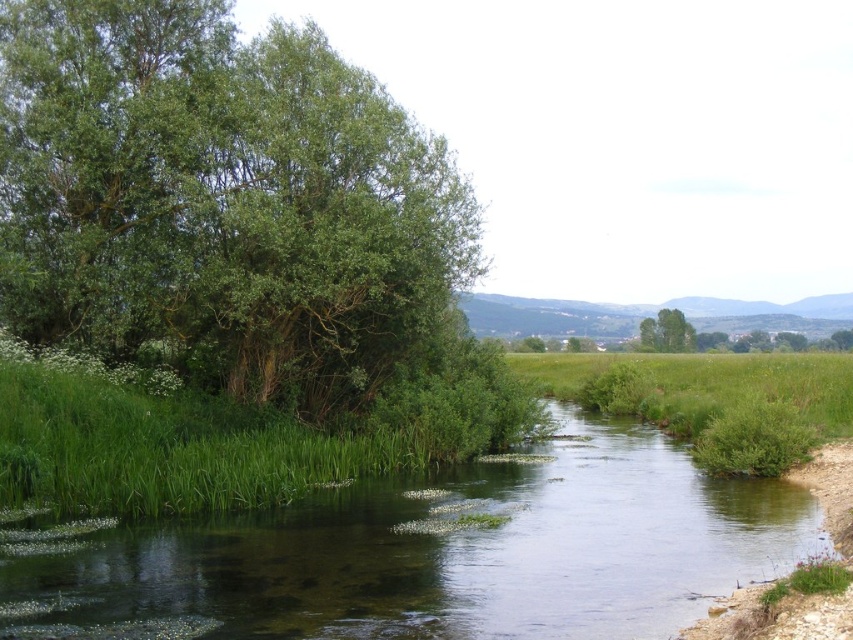
In the scene shown: You are a bird looking for a nesting spot. You see the green leafy tree at left and the green leafy tree at center. Which tree would you choose if you prefer a larger tree for nesting?

The green leafy tree at left is bigger than the green leafy tree at center, so you should choose the green leafy tree at left for nesting.

You are standing at the point marked as point [440,554] in the image. Looking around, you see the green grassy river at center. What is the name of the feature located exactly at your current position?

The green grassy river at center is located at point [440,554], so the feature at your current position is the green grassy river at center.